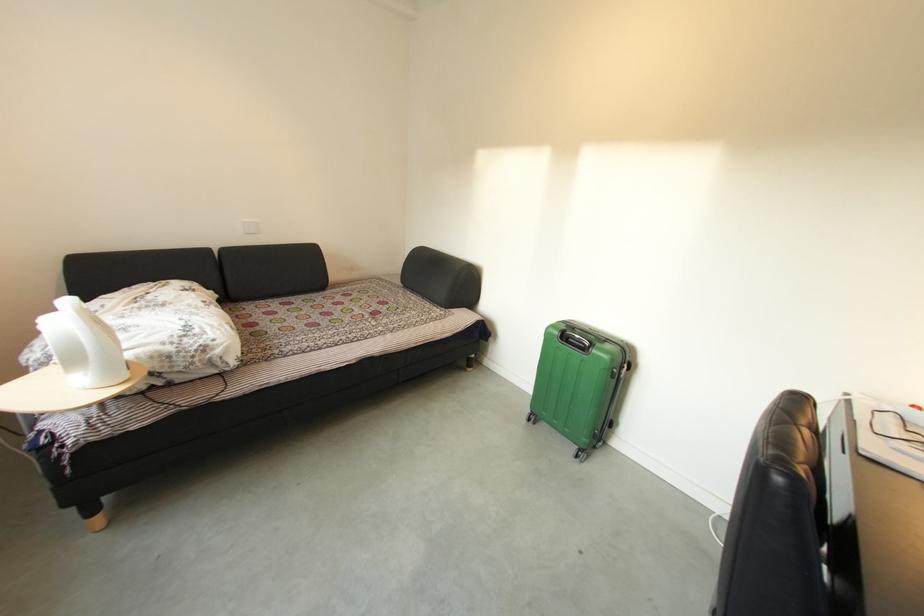
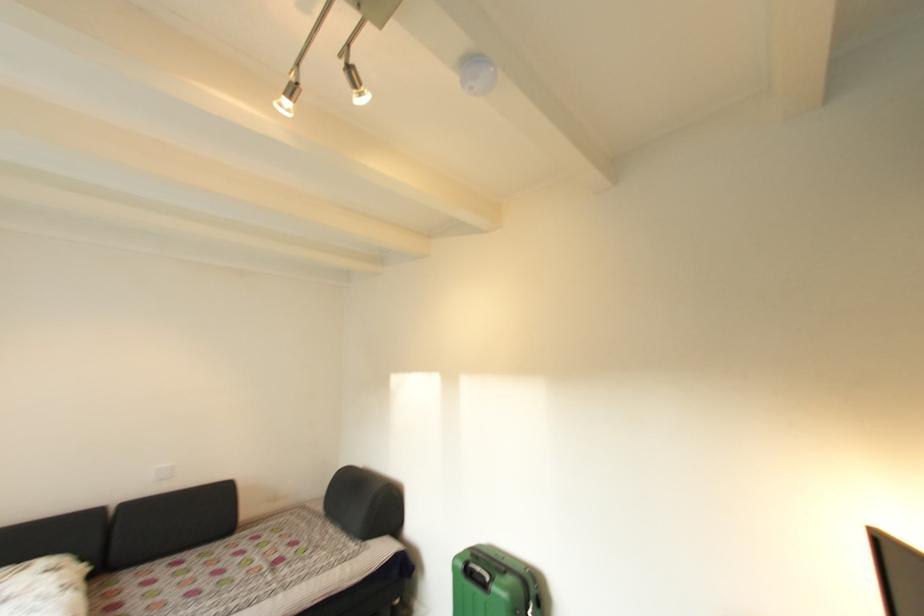
In the second image, find the point that corresponds to (426,301) in the first image.

(344, 533)